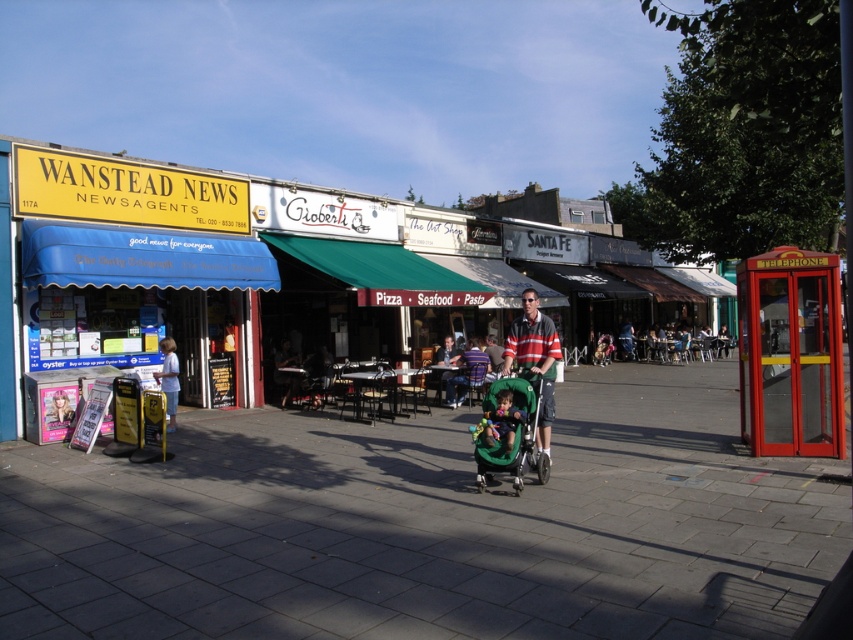
Question: Can you confirm if smooth concrete pavement at lower left is bigger than striped shirt at center?

Choices:
 (A) no
 (B) yes

Answer: (B)

Question: Considering the relative positions of green fabric stroller at center and striped shirt at center in the image provided, where is green fabric stroller at center located with respect to striped shirt at center?

Choices:
 (A) right
 (B) left

Answer: (A)

Question: Which of these objects is positioned farthest from the green fabric baby carriage at center?

Choices:
 (A) blonde hair at center
 (B) green fabric stroller at center

Answer: (A)

Question: Which of the following is the closest to the observer?

Choices:
 (A) green fabric baby carriage at center
 (B) green fabric stroller at center
 (C) smooth black jacket at center
 (D) blonde hair at center

Answer: (B)

Question: Can you confirm if striped cotton shirt at center is wider than green fabric baby carriage at center?

Choices:
 (A) yes
 (B) no

Answer: (A)

Question: Which of these objects is positioned farthest from the green fabric baby carriage at center?

Choices:
 (A) striped shirt at center
 (B) green fabric stroller at center

Answer: (A)